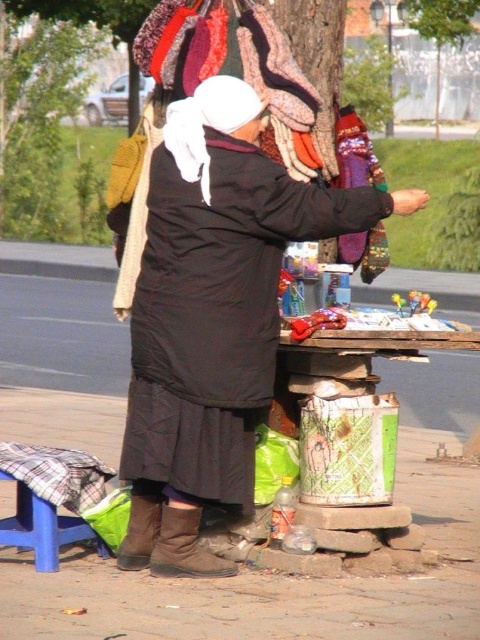
Does green leafy tree at left appear on the left side of green leafy tree at upper center?

Yes, green leafy tree at left is to the left of green leafy tree at upper center.

Can you confirm if green leafy tree at left is shorter than green leafy tree at upper center?

No.

Locate an element on the screen. green leafy tree at left is located at coordinates (37, 113).

You are a GUI agent. You are given a task and a screenshot of the screen. Output one action in this format:
    pyautogui.click(x=<x>, y=<y>)
    Task: Click on the green leafy tree at left
    The image size is (480, 640).
    Given the screenshot: What is the action you would take?
    pyautogui.click(x=37, y=113)

Which is more to the left, black matte coat at center or green leafy tree at upper center?

black matte coat at center

Can you confirm if black matte coat at center is bigger than green leafy tree at upper center?

No, black matte coat at center is not bigger than green leafy tree at upper center.

Who is more distant from viewer, [239,236] or [439,92]?

Positioned behind is point [439,92].

Where is `black matte coat at center`? The height and width of the screenshot is (640, 480). black matte coat at center is located at coordinates click(x=216, y=314).

Does point (364, 211) come in front of point (39, 19)?

Yes.

Between point (144, 349) and point (0, 220), which one is positioned behind?

The point (0, 220) is behind.

Locate an element on the screen. The image size is (480, 640). black matte coat at center is located at coordinates (216, 314).